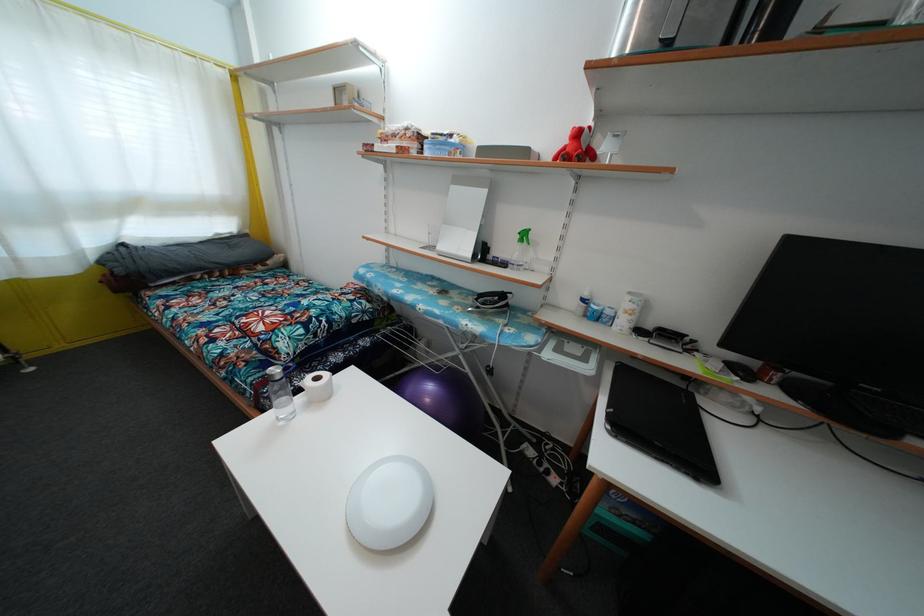
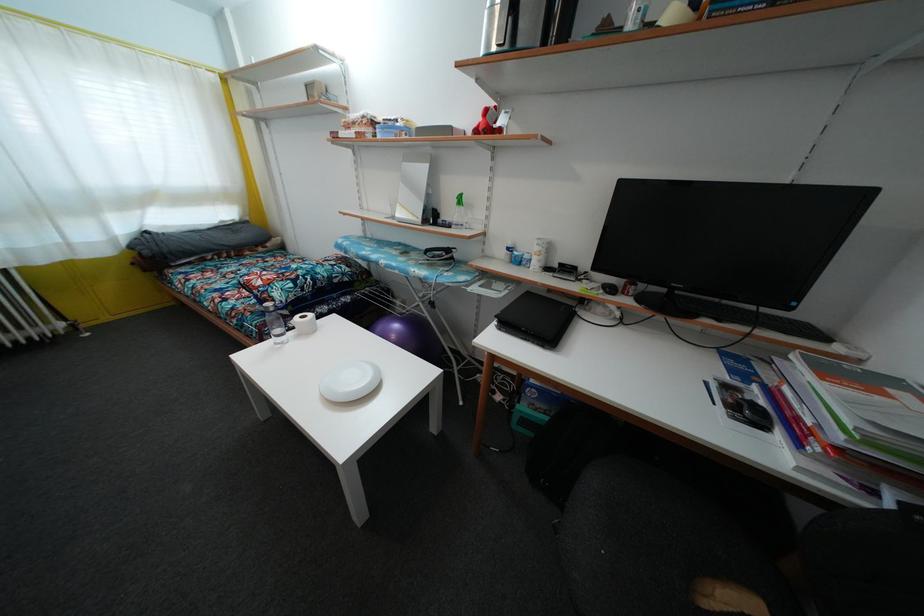
Find the pixel in the second image that matches [444,363] in the first image.

(411, 315)